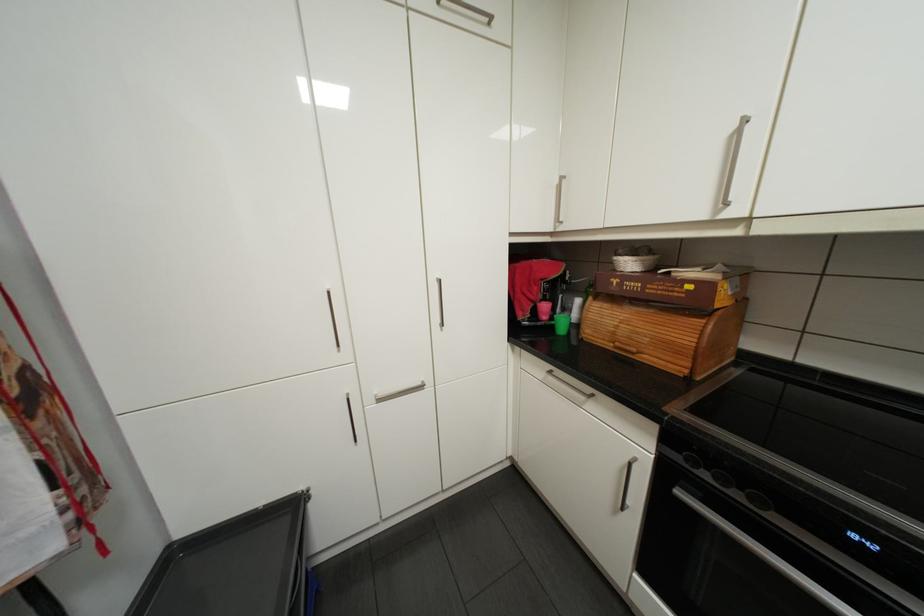
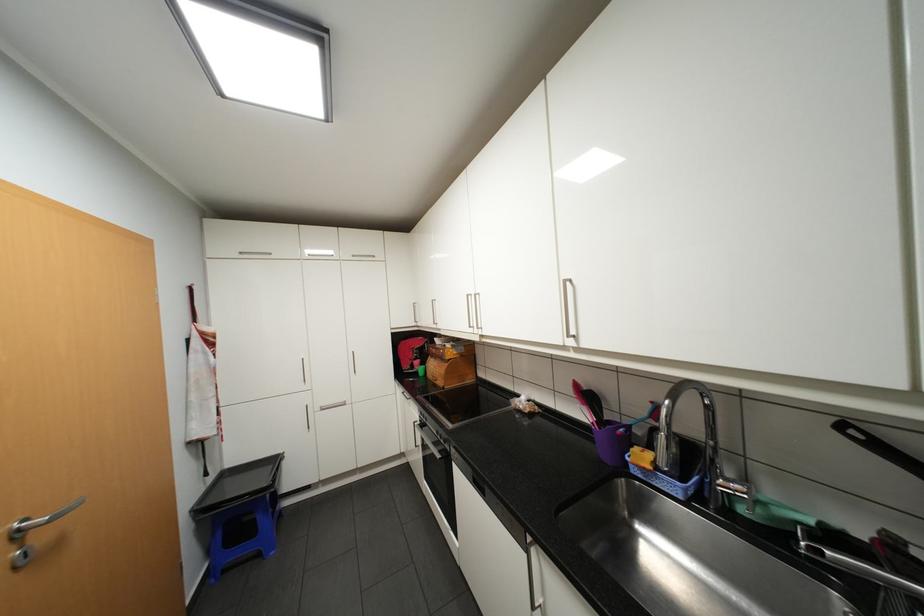
Find the pixel in the second image that matches the point at 545,221 in the first image.

(412, 322)